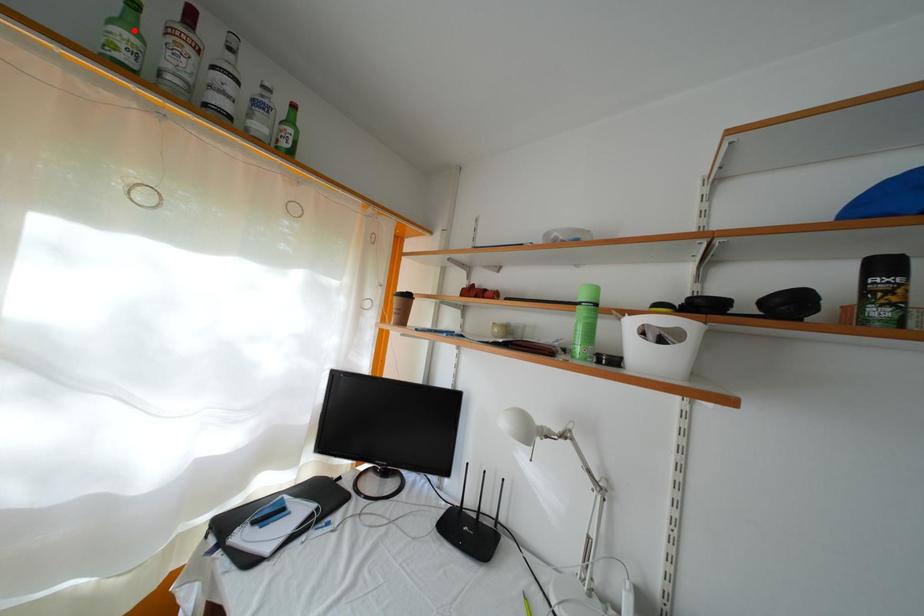
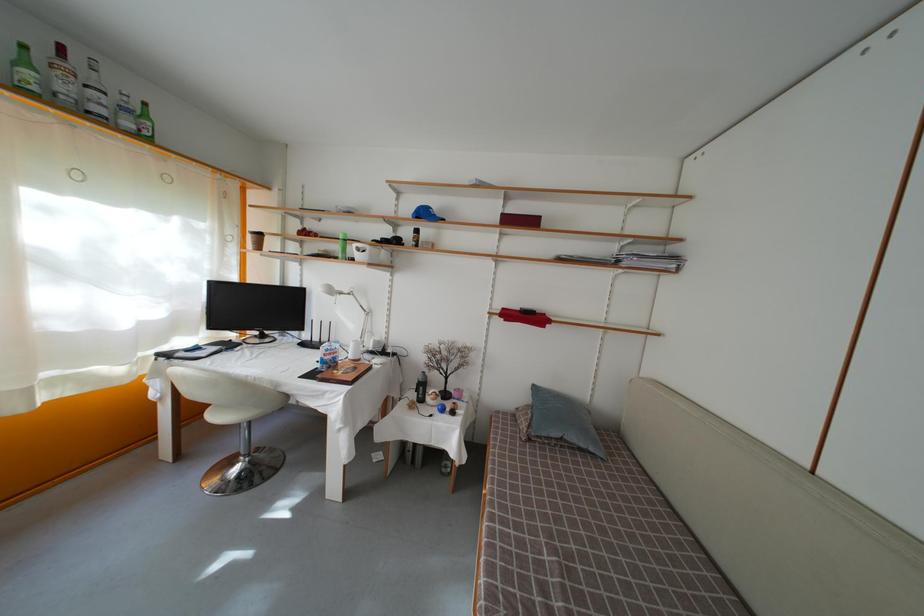
Where in the second image is the point corresponding to the highlighted location from the first image?

(31, 69)